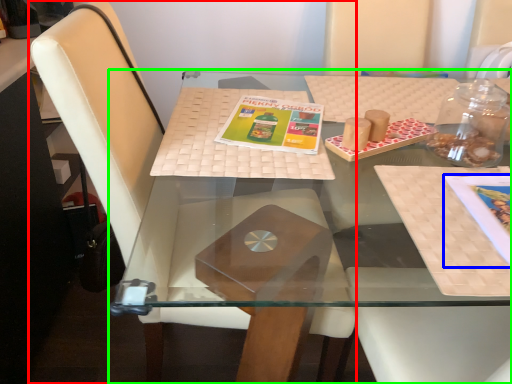
Question: Which object is positioned farthest from chair (highlighted by a red box)? Select from book cover (highlighted by a blue box) and table (highlighted by a green box).

Choices:
 (A) book cover
 (B) table

Answer: (A)